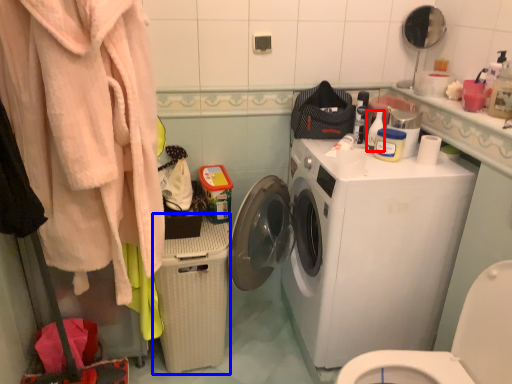
Question: Among these objects, which one is farthest to the camera, cleaning product (highlighted by a red box) or dish washer (highlighted by a blue box)?

Choices:
 (A) cleaning product
 (B) dish washer

Answer: (A)